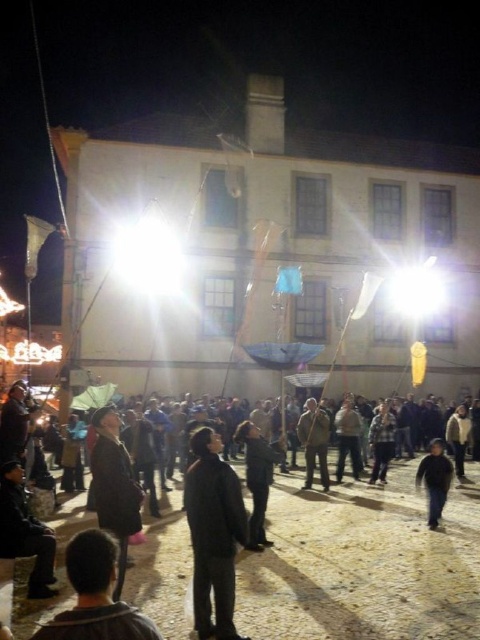
You are a photographer standing at the edge of the courtyard. You want to take a photo of the dark gray fabric jacket at center without including the building in the background. Is the jacket positioned in a way that allows this?

The dark gray fabric jacket at center is located at point (257, 477), which is likely positioned away from the building, so yes, it can be photographed without including the building in the background.

You are a photographer positioned at the edge of the courtyard. You want to capture a photo that includes both the dark gray fabric jacket at center and the dark blue jeans at lower right. Based on their positions, which object should you adjust your camera to focus on first to ensure both are in the frame?

The dark gray fabric jacket at center is to the left of dark blue jeans at lower right, so you should focus on the dark gray fabric jacket at center first to ensure both are included in the frame.

You are a stage director planning to place a 6.5 meters long banner between the dark gray fabric jacket at center and the dark gray fabric at center. Is there enough space for the banner?

The distance between the dark gray fabric jacket at center and the dark gray fabric at center is 6.48 meters, which is slightly shorter than the banner length of 6.5 meters. Therefore, the banner may not fit without overlapping or bending.